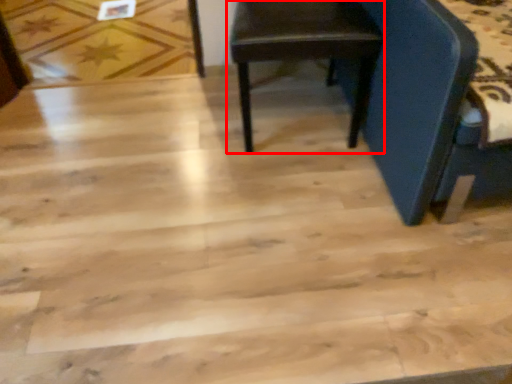
Question: From the image's perspective, what is the correct spatial positioning of chair (annotated by the red box) in reference to plywood?

Choices:
 (A) below
 (B) above

Answer: (A)